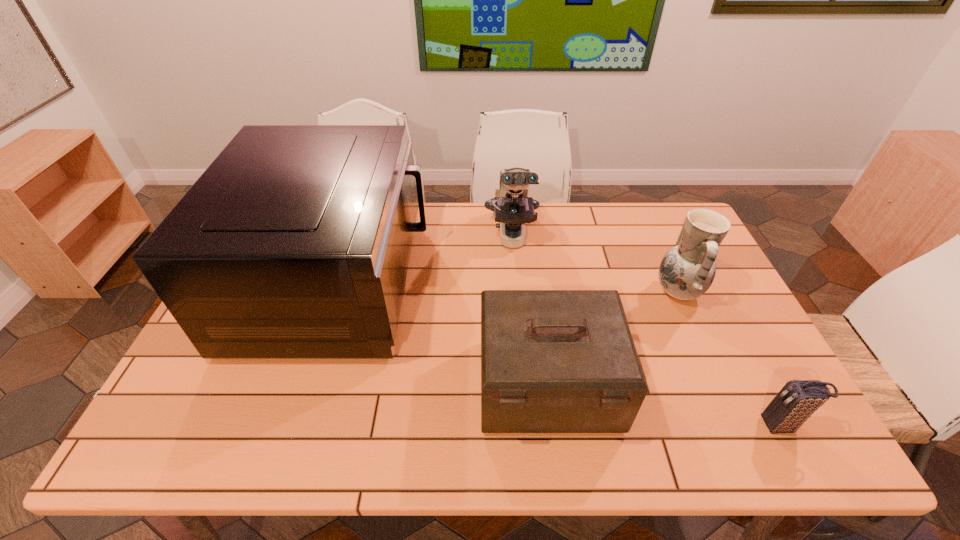
Locate an element on the screen. The height and width of the screenshot is (540, 960). free location that satisfies the following two spatial constraints: 1. through the eyepieces of the microscope; 2. on the front-facing side of the leftmost object is located at coordinates (516, 283).

I want to click on free location that satisfies the following two spatial constraints: 1. on either side of the pottery; 2. on the front side of the first-aid kit, so click(719, 385).